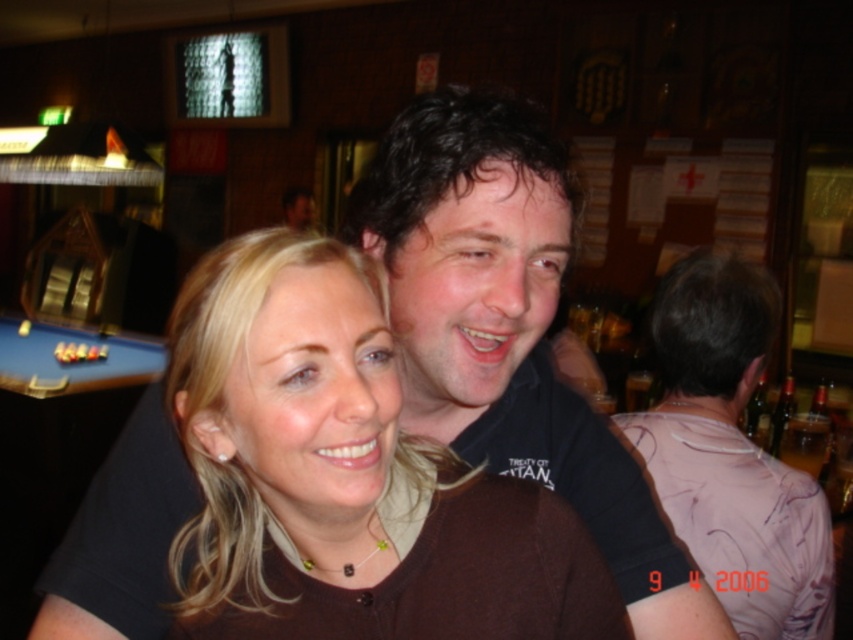
Between point (177, 577) and point (148, 376), which one is positioned behind?

The point (148, 376) is behind.

Locate an element on the screen. The width and height of the screenshot is (853, 640). brown matte shirt at center is located at coordinates pyautogui.click(x=344, y=474).

Is point (386, 372) positioned in front of point (39, 342)?

Yes, it is in front of point (39, 342).

The width and height of the screenshot is (853, 640). Find the location of `brown matte shirt at center`. brown matte shirt at center is located at coordinates (344, 474).